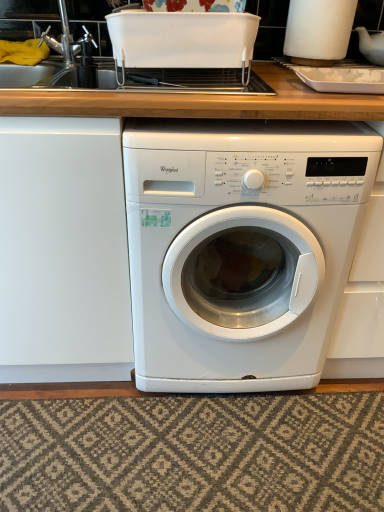
Image resolution: width=384 pixels, height=512 pixels. Describe the element at coordinates (318, 30) in the screenshot. I see `white glossy container at upper right, which is the second appliance in left-to-right order` at that location.

From the picture: How much space does white plastic container at upper center, acting as the 1th appliance starting from the left, occupy horizontally?

white plastic container at upper center, acting as the 1th appliance starting from the left, is 11.33 inches wide.

The image size is (384, 512). What do you see at coordinates (182, 40) in the screenshot? I see `white plastic container at upper center, the second appliance when ordered from right to left` at bounding box center [182, 40].

You are a GUI agent. You are given a task and a screenshot of the screen. Output one action in this format:
    pyautogui.click(x=<x>, y=<y>)
    Task: Click on the textured beige rug at lower center
    This screenshot has height=512, width=384.
    Given the screenshot: What is the action you would take?
    pyautogui.click(x=194, y=453)

In order to face textured beige rug at lower center, should I rotate leftwards or rightwards?

It's best to rotate right around 1.060 degrees.

This screenshot has height=512, width=384. Find the location of `brushed metal sink at upper left`. brushed metal sink at upper left is located at coordinates (59, 51).

Consider the image. From the image's perspective, is textured beige rug at lower center above or below white glossy container at upper right, which is the second appliance in left-to-right order?

Clearly, from the image's perspective, textured beige rug at lower center is below white glossy container at upper right, which is the second appliance in left-to-right order.

Does textured beige rug at lower center have a larger size compared to white glossy container at upper right, which appears as the 1th appliance when viewed from the right?

Indeed, textured beige rug at lower center has a larger size compared to white glossy container at upper right, which appears as the 1th appliance when viewed from the right.

Considering the sizes of textured beige rug at lower center and white glossy container at upper right, which appears as the 1th appliance when viewed from the right, in the image, is textured beige rug at lower center taller or shorter than white glossy container at upper right, which appears as the 1th appliance when viewed from the right,?

Considering their sizes, textured beige rug at lower center has less height than white glossy container at upper right, which appears as the 1th appliance when viewed from the right.

Is point (355, 487) closer or farther from the camera than point (284, 46)?

Point (355, 487).

Measure the distance from brushed metal sink at upper left to white plastic container at upper center, acting as the 1th appliance starting from the left.

brushed metal sink at upper left and white plastic container at upper center, acting as the 1th appliance starting from the left, are 12.35 inches apart from each other.

From the image's perspective, is brushed metal sink at upper left located above or below white plastic container at upper center, the second appliance when ordered from right to left?

Clearly, from the image's perspective, brushed metal sink at upper left is above white plastic container at upper center, the second appliance when ordered from right to left.

Which of these two, brushed metal sink at upper left or white plastic container at upper center, the second appliance when ordered from right to left, is smaller?

Smaller between the two is brushed metal sink at upper left.

Could you tell me if white glossy washing machine at center is turned towards brushed metal sink at upper left?

No, white glossy washing machine at center is not facing towards brushed metal sink at upper left.

Which is more to the left, white glossy washing machine at center or brushed metal sink at upper left?

From the viewer's perspective, brushed metal sink at upper left appears more on the left side.

Can you see white glossy washing machine at center touching brushed metal sink at upper left?

No, white glossy washing machine at center is not next to brushed metal sink at upper left.

Considering the points (228, 201) and (129, 63), which point is in front, point (228, 201) or point (129, 63)?

Point (228, 201)

Which object is thinner, white glossy washing machine at center or white plastic container at upper center, acting as the 1th appliance starting from the left?

Thinner between the two is white plastic container at upper center, acting as the 1th appliance starting from the left.

From the image's perspective, who appears lower, white glossy washing machine at center or white plastic container at upper center, acting as the 1th appliance starting from the left?

white glossy washing machine at center, from the image's perspective.

From a real-world perspective, does white glossy washing machine at center stand above white plastic container at upper center, the second appliance when ordered from right to left?

No, from a real-world perspective, white glossy washing machine at center is not on top of white plastic container at upper center, the second appliance when ordered from right to left.

Find the location of a particular element. mat below the white glossy container at upper right, which appears as the 1th appliance when viewed from the right (from a real-world perspective) is located at coordinates (194, 453).

Is white glossy container at upper right, which appears as the 1th appliance when viewed from the right, positioned in front of textured beige rug at lower center?

No, it is not.

Is white glossy container at upper right, which appears as the 1th appliance when viewed from the right, taller than textured beige rug at lower center?

Yes, white glossy container at upper right, which appears as the 1th appliance when viewed from the right, is taller than textured beige rug at lower center.

How much distance is there between white plastic container at upper center, acting as the 1th appliance starting from the left, and brushed metal sink at upper left?

white plastic container at upper center, acting as the 1th appliance starting from the left, is 12.35 inches from brushed metal sink at upper left.

Could you tell me if white plastic container at upper center, acting as the 1th appliance starting from the left, is facing brushed metal sink at upper left?

No.

Which is in front, point (136, 42) or point (55, 45)?

Point (136, 42)

Which is behind, white plastic container at upper center, acting as the 1th appliance starting from the left, or brushed metal sink at upper left?

brushed metal sink at upper left.

Would you say textured beige rug at lower center contains white plastic container at upper center, acting as the 1th appliance starting from the left?

No.

From the image's perspective, does textured beige rug at lower center appear lower than white plastic container at upper center, acting as the 1th appliance starting from the left?

Yes, from the image's perspective, textured beige rug at lower center is below white plastic container at upper center, acting as the 1th appliance starting from the left.

Considering the sizes of objects textured beige rug at lower center and white plastic container at upper center, acting as the 1th appliance starting from the left, in the image provided, who is wider, textured beige rug at lower center or white plastic container at upper center, acting as the 1th appliance starting from the left,?

With larger width is textured beige rug at lower center.

Is there a large distance between textured beige rug at lower center and white plastic container at upper center, the second appliance when ordered from right to left?

That's right, there is a large distance between textured beige rug at lower center and white plastic container at upper center, the second appliance when ordered from right to left.

Locate an element on the screen. mat in front of the white glossy container at upper right, which is the second appliance in left-to-right order is located at coordinates (194, 453).

Locate an element on the screen. Image resolution: width=384 pixels, height=512 pixels. sink on the left side of white plastic container at upper center, acting as the 1th appliance starting from the left is located at coordinates (59, 51).

Estimate the real-world distances between objects in this image. Which object is further from white glossy washing machine at center, white glossy container at upper right, which is the second appliance in left-to-right order, or textured beige rug at lower center?

white glossy container at upper right, which is the second appliance in left-to-right order, is further to white glossy washing machine at center.

Looking at the image, which one is located further to white glossy container at upper right, which is the second appliance in left-to-right order, brushed metal sink at upper left or textured beige rug at lower center?

textured beige rug at lower center.

Looking at this image, when comparing their distances from white plastic container at upper center, the second appliance when ordered from right to left, does brushed metal sink at upper left or textured beige rug at lower center seem closer?

brushed metal sink at upper left lies closer to white plastic container at upper center, the second appliance when ordered from right to left, than the other object.

From the image, which object appears to be farther from white glossy washing machine at center, textured beige rug at lower center or white plastic container at upper center, the second appliance when ordered from right to left?

white plastic container at upper center, the second appliance when ordered from right to left, is positioned further to the anchor white glossy washing machine at center.

Looking at this image, considering their positions, is white glossy container at upper right, which appears as the 1th appliance when viewed from the right, positioned closer to white plastic container at upper center, acting as the 1th appliance starting from the left, than white glossy washing machine at center?

The object closer to white plastic container at upper center, acting as the 1th appliance starting from the left, is white glossy container at upper right, which appears as the 1th appliance when viewed from the right.

Estimate the real-world distances between objects in this image. Which object is closer to textured beige rug at lower center, white plastic container at upper center, the second appliance when ordered from right to left, or white glossy container at upper right, which appears as the 1th appliance when viewed from the right?

white plastic container at upper center, the second appliance when ordered from right to left, is positioned closer to the anchor textured beige rug at lower center.

Which object lies nearer to the anchor point brushed metal sink at upper left, textured beige rug at lower center or white plastic container at upper center, acting as the 1th appliance starting from the left?

Based on the image, white plastic container at upper center, acting as the 1th appliance starting from the left, appears to be nearer to brushed metal sink at upper left.

When comparing their distances from white plastic container at upper center, the second appliance when ordered from right to left, does white glossy container at upper right, which appears as the 1th appliance when viewed from the right, or brushed metal sink at upper left seem closer?

The object closer to white plastic container at upper center, the second appliance when ordered from right to left, is brushed metal sink at upper left.

Locate an element on the screen. This screenshot has height=512, width=384. appliance that lies between brushed metal sink at upper left and white glossy washing machine at center from top to bottom is located at coordinates (182, 40).

Locate an element on the screen. appliance between brushed metal sink at upper left and textured beige rug at lower center in the up-down direction is located at coordinates (182, 40).

The width and height of the screenshot is (384, 512). In order to click on washing machine between brushed metal sink at upper left and white glossy container at upper right, which is the second appliance in left-to-right order, in the horizontal direction in this screenshot , I will do (241, 248).

Identify the location of washing machine between brushed metal sink at upper left and textured beige rug at lower center vertically. The width and height of the screenshot is (384, 512). (241, 248).